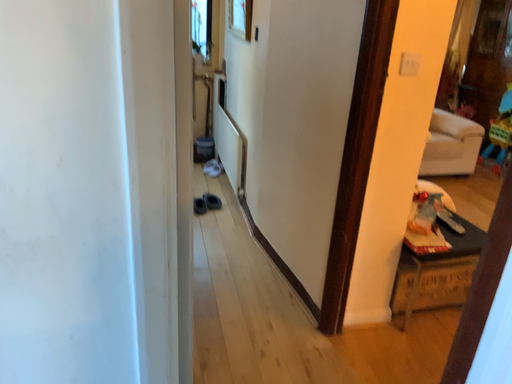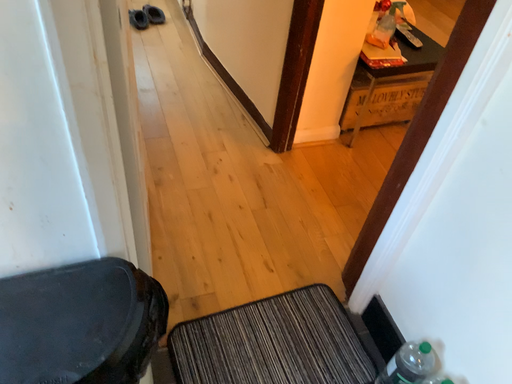
Question: Which way did the camera rotate in the video?

Choices:
 (A) rotated right
 (B) rotated left

Answer: (A)